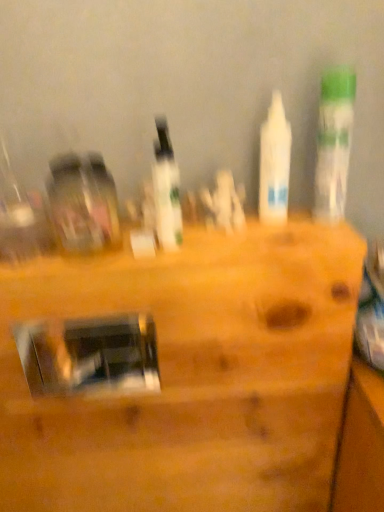
Describe the element at coordinates (166, 190) in the screenshot. I see `white glossy bottle at center, the first bottle in the left-to-right sequence` at that location.

The width and height of the screenshot is (384, 512). In order to click on metallic silver mirror at center in this screenshot , I will do `click(192, 376)`.

Measure the distance between white matte bottle at center, the 2th bottle in the left-to-right sequence, and camera.

They are 26.70 inches apart.

Where is `white glossy bottle at center, the first bottle in the left-to-right sequence`? white glossy bottle at center, the first bottle in the left-to-right sequence is located at coordinates (166, 190).

Which object is wider, white matte bottle at center, the 2th bottle in the left-to-right sequence, or white glossy bottle at center, the first bottle in the left-to-right sequence?

white glossy bottle at center, the first bottle in the left-to-right sequence, is wider.

From a real-world perspective, who is located higher, white matte bottle at center, the 2th bottle in the left-to-right sequence, or white glossy bottle at center, the first bottle in the left-to-right sequence?

From a 3D spatial view, white matte bottle at center, the 2th bottle in the left-to-right sequence, is above.

Can you tell me how much white matte bottle at center, which is the 2th bottle from right to left, and white glossy bottle at center, the first bottle in the left-to-right sequence, differ in facing direction?

The angle between the facing direction of white matte bottle at center, which is the 2th bottle from right to left, and the facing direction of white glossy bottle at center, the first bottle in the left-to-right sequence, is 1.14 degrees.

Can you confirm if white matte bottle at center, which is the 2th bottle from right to left, is smaller than white glossy bottle at center, the first bottle in the left-to-right sequence?

Correct, white matte bottle at center, which is the 2th bottle from right to left, occupies less space than white glossy bottle at center, the first bottle in the left-to-right sequence.

Could you tell me if white glossy bottle at upper right, the third bottle positioned from the left, is facing white glossy bottle at center, the first bottle in the left-to-right sequence?

No, white glossy bottle at upper right, the third bottle positioned from the left, is not turned towards white glossy bottle at center, the first bottle in the left-to-right sequence.

Is white glossy bottle at upper right, the third bottle positioned from the left, further to camera compared to white glossy bottle at center, the first bottle in the left-to-right sequence?

Yes, it is.

Is white glossy bottle at upper right, the first bottle viewed from the right, positioned beyond the bounds of white glossy bottle at center, the first bottle in the left-to-right sequence?

Yes, white glossy bottle at upper right, the first bottle viewed from the right, is not within white glossy bottle at center, the first bottle in the left-to-right sequence.

Can you see white glossy bottle at upper right, the third bottle positioned from the left, touching white glossy bottle at center, the first bottle in the left-to-right sequence?

No.

Does white glossy bottle at upper right, the third bottle positioned from the left, turn towards metallic silver mirror at center?

No.

Is white glossy bottle at upper right, the first bottle viewed from the right, bigger or smaller than metallic silver mirror at center?

white glossy bottle at upper right, the first bottle viewed from the right, is smaller than metallic silver mirror at center.

Does white glossy bottle at upper right, the third bottle positioned from the left, touch metallic silver mirror at center?

white glossy bottle at upper right, the third bottle positioned from the left, and metallic silver mirror at center are clearly separated.

Is metallic silver mirror at center facing towards white glossy bottle at upper right, the third bottle positioned from the left?

No.

Consider the image. From the image's perspective, which one is positioned lower, metallic silver mirror at center or white glossy bottle at upper right, the first bottle viewed from the right?

metallic silver mirror at center is shown below in the image.

Would you say metallic silver mirror at center is to the left or to the right of white glossy bottle at upper right, the first bottle viewed from the right, in the picture?

metallic silver mirror at center is positioned on white glossy bottle at upper right, the first bottle viewed from the right,'s left side.

Considering the relative sizes of metallic silver mirror at center and white glossy bottle at upper right, the first bottle viewed from the right, in the image provided, is metallic silver mirror at center wider than white glossy bottle at upper right, the first bottle viewed from the right,?

Indeed, metallic silver mirror at center has a greater width compared to white glossy bottle at upper right, the first bottle viewed from the right.

Between point (152, 176) and point (332, 136), which one is positioned in front?

Positioned in front is point (152, 176).

Considering the positions of objects white glossy bottle at center, the first bottle in the left-to-right sequence, and white glossy bottle at upper right, the first bottle viewed from the right, in the image provided, who is in front, white glossy bottle at center, the first bottle in the left-to-right sequence, or white glossy bottle at upper right, the first bottle viewed from the right,?

Positioned in front is white glossy bottle at center, the first bottle in the left-to-right sequence.

Considering the relative sizes of white glossy bottle at center, the first bottle in the left-to-right sequence, and white glossy bottle at upper right, the third bottle positioned from the left, in the image provided, is white glossy bottle at center, the first bottle in the left-to-right sequence, bigger than white glossy bottle at upper right, the third bottle positioned from the left,?

No.

Is white glossy bottle at center, the first bottle in the left-to-right sequence, in contact with white glossy bottle at upper right, the third bottle positioned from the left?

white glossy bottle at center, the first bottle in the left-to-right sequence, and white glossy bottle at upper right, the third bottle positioned from the left, are clearly separated.

Is metallic silver mirror at center positioned far away from white matte bottle at center, which is the 2th bottle from right to left?

No, metallic silver mirror at center is in close proximity to white matte bottle at center, which is the 2th bottle from right to left.

Considering the relative sizes of metallic silver mirror at center and white matte bottle at center, the 2th bottle in the left-to-right sequence, in the image provided, is metallic silver mirror at center wider than white matte bottle at center, the 2th bottle in the left-to-right sequence,?

Correct, the width of metallic silver mirror at center exceeds that of white matte bottle at center, the 2th bottle in the left-to-right sequence.

Can you confirm if metallic silver mirror at center is shorter than white matte bottle at center, which is the 2th bottle from right to left?

No.

Considering the sizes of objects white glossy bottle at upper right, the third bottle positioned from the left, and white matte bottle at center, the 2th bottle in the left-to-right sequence, in the image provided, who is shorter, white glossy bottle at upper right, the third bottle positioned from the left, or white matte bottle at center, the 2th bottle in the left-to-right sequence,?

white matte bottle at center, the 2th bottle in the left-to-right sequence.

Is point (329, 127) closer or farther from the camera than point (273, 208)?

Point (329, 127) is positioned closer to the camera compared to point (273, 208).

Does white glossy bottle at upper right, the first bottle viewed from the right, appear on the left side of white matte bottle at center, the 2th bottle in the left-to-right sequence?

No, white glossy bottle at upper right, the first bottle viewed from the right, is not to the left of white matte bottle at center, the 2th bottle in the left-to-right sequence.

Is white glossy bottle at upper right, the first bottle viewed from the right, with white matte bottle at center, the 2th bottle in the left-to-right sequence?

Absolutely, white glossy bottle at upper right, the first bottle viewed from the right, is next to and touching white matte bottle at center, the 2th bottle in the left-to-right sequence.

Starting from the white glossy bottle at center, arranged as the 3th bottle when viewed from the right, which bottle is the 1st one to the right? Please provide its 2D coordinates.

[(274, 163)]

From a real-world perspective, starting from the white glossy bottle at center, the first bottle in the left-to-right sequence, which bottle is the 2nd one vertically above it? Please provide its 2D coordinates.

[(334, 143)]

Which object lies further to the anchor point white glossy bottle at center, arranged as the 3th bottle when viewed from the right, metallic silver mirror at center or white matte bottle at center, the 2th bottle in the left-to-right sequence?

metallic silver mirror at center is further to white glossy bottle at center, arranged as the 3th bottle when viewed from the right.

From the image, which object appears to be farther from white matte bottle at center, which is the 2th bottle from right to left, metallic silver mirror at center or white glossy bottle at center, the first bottle in the left-to-right sequence?

metallic silver mirror at center is positioned further to the anchor white matte bottle at center, which is the 2th bottle from right to left.

When comparing their distances from white matte bottle at center, the 2th bottle in the left-to-right sequence, does white glossy bottle at upper right, the first bottle viewed from the right, or white glossy bottle at center, arranged as the 3th bottle when viewed from the right, seem further?

Among the two, white glossy bottle at center, arranged as the 3th bottle when viewed from the right, is located further to white matte bottle at center, the 2th bottle in the left-to-right sequence.

Considering their positions, is metallic silver mirror at center positioned closer to white glossy bottle at upper right, the third bottle positioned from the left, than white matte bottle at center, which is the 2th bottle from right to left?

The object closer to white glossy bottle at upper right, the third bottle positioned from the left, is white matte bottle at center, which is the 2th bottle from right to left.

Considering their positions, is white matte bottle at center, which is the 2th bottle from right to left, positioned further to white glossy bottle at upper right, the third bottle positioned from the left, than white glossy bottle at center, arranged as the 3th bottle when viewed from the right?

white glossy bottle at center, arranged as the 3th bottle when viewed from the right.

From the image, which object appears to be farther from metallic silver mirror at center, white matte bottle at center, the 2th bottle in the left-to-right sequence, or white glossy bottle at upper right, the first bottle viewed from the right?

white glossy bottle at upper right, the first bottle viewed from the right, is positioned further to the anchor metallic silver mirror at center.

From the image, which object appears to be farther from white glossy bottle at upper right, the third bottle positioned from the left, white matte bottle at center, which is the 2th bottle from right to left, or metallic silver mirror at center?

metallic silver mirror at center lies further to white glossy bottle at upper right, the third bottle positioned from the left, than the other object.

Estimate the real-world distances between objects in this image. Which object is further from white matte bottle at center, the 2th bottle in the left-to-right sequence, metallic silver mirror at center or white glossy bottle at upper right, the third bottle positioned from the left?

Among the two, metallic silver mirror at center is located further to white matte bottle at center, the 2th bottle in the left-to-right sequence.

The width and height of the screenshot is (384, 512). What are the coordinates of `bottle between white glossy bottle at center, arranged as the 3th bottle when viewed from the right, and white glossy bottle at upper right, the third bottle positioned from the left, from left to right` in the screenshot? It's located at (274, 163).

Locate an element on the screen. bottle between white matte bottle at center, which is the 2th bottle from right to left, and metallic silver mirror at center vertically is located at coordinates (166, 190).